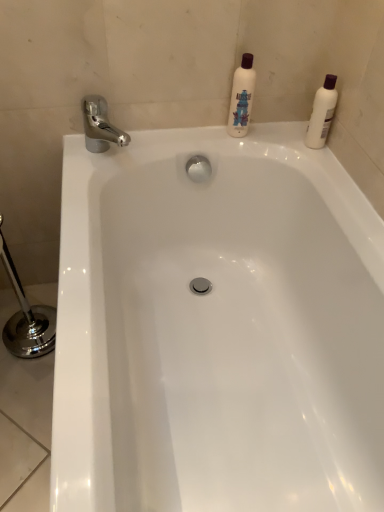
Question: Considering the relative sizes of white matte bottle at upper center, which is the 2th cleaning product in right-to-left order, and chrome metallic faucet at upper left in the image provided, is white matte bottle at upper center, which is the 2th cleaning product in right-to-left order, bigger than chrome metallic faucet at upper left?

Choices:
 (A) yes
 (B) no

Answer: (B)

Question: Are white matte bottle at upper center, which is the 2th cleaning product in right-to-left order, and chrome metallic faucet at upper left making contact?

Choices:
 (A) yes
 (B) no

Answer: (B)

Question: Considering the relative sizes of white matte bottle at upper center, which is the 2th cleaning product in right-to-left order, and chrome metallic faucet at upper left in the image provided, is white matte bottle at upper center, which is the 2th cleaning product in right-to-left order, wider than chrome metallic faucet at upper left?

Choices:
 (A) no
 (B) yes

Answer: (A)

Question: Can you confirm if white matte bottle at upper center, which is the 1th cleaning product in left-to-right order, is taller than chrome metallic faucet at upper left?

Choices:
 (A) no
 (B) yes

Answer: (B)

Question: Is white matte bottle at upper center, which is the 2th cleaning product in right-to-left order, looking in the opposite direction of chrome metallic faucet at upper left?

Choices:
 (A) no
 (B) yes

Answer: (A)

Question: Considering the relative positions of white matte bottle at upper center, which is the 2th cleaning product in right-to-left order, and chrome metallic faucet at upper left in the image provided, is white matte bottle at upper center, which is the 2th cleaning product in right-to-left order, in front of chrome metallic faucet at upper left?

Choices:
 (A) no
 (B) yes

Answer: (A)

Question: Considering the relative sizes of white glossy bathtub at center and chrome metallic faucet at upper left in the image provided, is white glossy bathtub at center thinner than chrome metallic faucet at upper left?

Choices:
 (A) no
 (B) yes

Answer: (A)

Question: Is the position of white glossy bathtub at center more distant than that of chrome metallic faucet at upper left?

Choices:
 (A) yes
 (B) no

Answer: (B)

Question: Is chrome metallic faucet at upper left completely or partially inside white glossy bathtub at center?

Choices:
 (A) yes
 (B) no

Answer: (B)

Question: From the image's perspective, would you say white glossy bathtub at center is shown under chrome metallic faucet at upper left?

Choices:
 (A) no
 (B) yes

Answer: (B)

Question: Is white glossy bathtub at center facing towards chrome metallic faucet at upper left?

Choices:
 (A) no
 (B) yes

Answer: (A)

Question: Can you confirm if white glossy bathtub at center is wider than chrome metallic faucet at upper left?

Choices:
 (A) no
 (B) yes

Answer: (B)

Question: Is white plastic bottle at upper right, which is the 2th cleaning product from left to right, to the left of white glossy bathtub at center from the viewer's perspective?

Choices:
 (A) no
 (B) yes

Answer: (A)